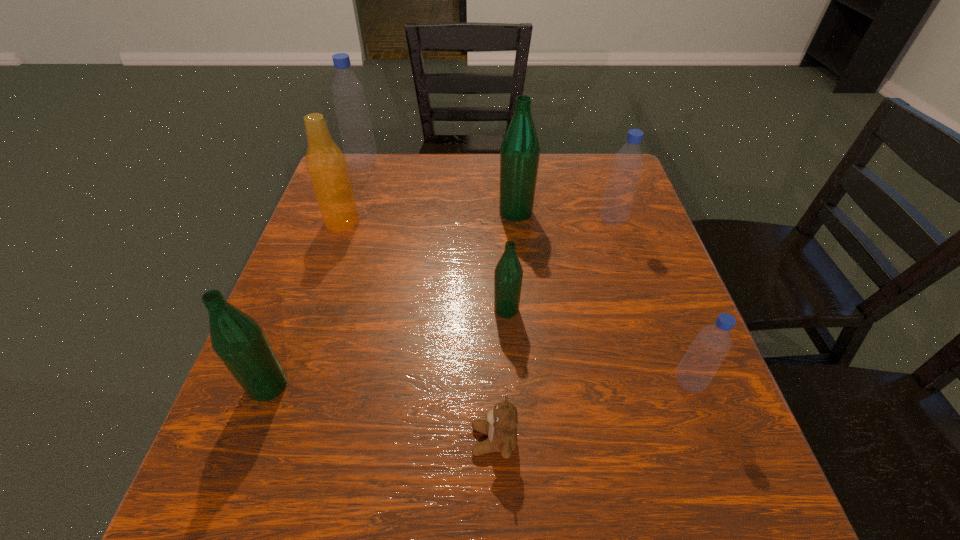
You are a GUI agent. You are given a task and a screenshot of the screen. Output one action in this format:
    pyautogui.click(x=<x>, y=<y>)
    Task: Click on the free spot at the far right corner of the desktop
    
    Given the screenshot: What is the action you would take?
    pyautogui.click(x=594, y=200)

In the image, there is a desktop. At what (x,y) coordinates should I click in order to perform the action: click on vacant space at the near right corner. Please return your answer as a coordinate pair (x, y). Looking at the image, I should click on (697, 481).

At what (x,y) coordinates should I click in order to perform the action: click on free space between the leftmost blue bottle and the second smallest green bottle. Please return your answer as a coordinate pair (x, y). This screenshot has height=540, width=960. Looking at the image, I should click on (315, 274).

Where is `free space between the second smallest blue bottle and the fifth farthest object`? This screenshot has height=540, width=960. free space between the second smallest blue bottle and the fifth farthest object is located at coordinates (560, 265).

At what (x,y) coordinates should I click in order to perform the action: click on empty space that is in between the leftmost green bottle and the shortest object. Please return your answer as a coordinate pair (x, y). This screenshot has height=540, width=960. Looking at the image, I should click on (381, 413).

Where is `vacant space in between the biggest green bottle and the smallest blue bottle`? vacant space in between the biggest green bottle and the smallest blue bottle is located at coordinates (602, 298).

At what (x,y) coordinates should I click in order to perform the action: click on empty space between the leftmost green bottle and the nearest object. Please return your answer as a coordinate pair (x, y). The height and width of the screenshot is (540, 960). Looking at the image, I should click on (381, 413).

Where is `vacant space in between the leftmost green bottle and the teddy bear`? This screenshot has width=960, height=540. vacant space in between the leftmost green bottle and the teddy bear is located at coordinates (381, 413).

Find the location of a particular element. The height and width of the screenshot is (540, 960). free space between the second nearest green bottle and the nearest object is located at coordinates (500, 375).

You are a GUI agent. You are given a task and a screenshot of the screen. Output one action in this format:
    pyautogui.click(x=<x>, y=<y>)
    Task: Click on the blank region between the leftmost blue bottle and the farthest green bottle
    
    Given the screenshot: What is the action you would take?
    pyautogui.click(x=440, y=187)